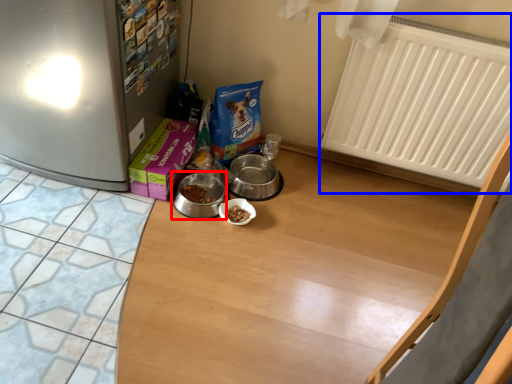
Question: Which object is further to the camera taking this photo, appliance (highlighted by a red box) or radiator (highlighted by a blue box)?

Choices:
 (A) appliance
 (B) radiator

Answer: (A)